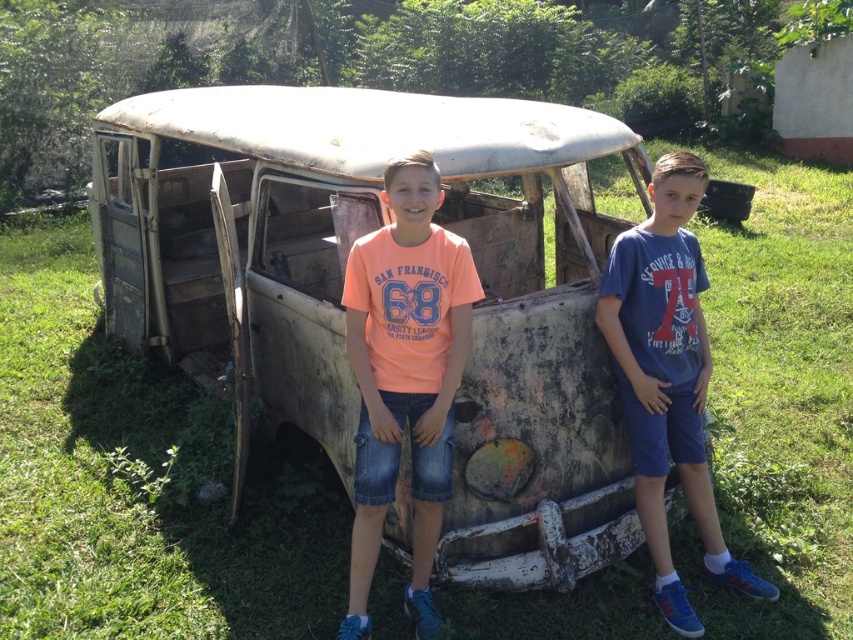
You are a photographer trying to capture both the rusty metal car at center and the blue denim shorts at right in the same frame. Considering their sizes, will the car appear larger than the shorts in the photo?

The rusty metal car at center is taller than blue denim shorts at right, so yes, the car will appear larger than the shorts in the photo.

You are a photographer trying to capture the two points in the image. Which point, point [431,468] or point [653,426], is closer to the camera?

Point [431,468] is in front of point [653,426], so it is closer to the camera.